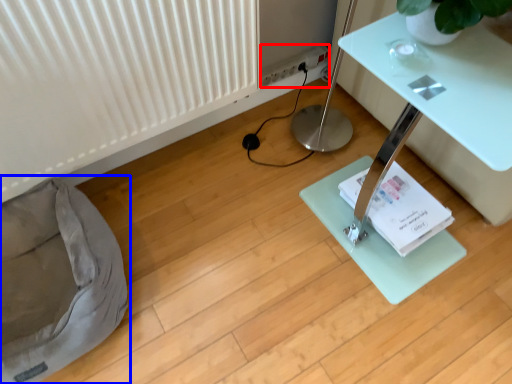
Question: Among these objects, which one is nearest to the camera, electric outlet (highlighted by a red box) or bean bag chair (highlighted by a blue box)?

Choices:
 (A) electric outlet
 (B) bean bag chair

Answer: (B)